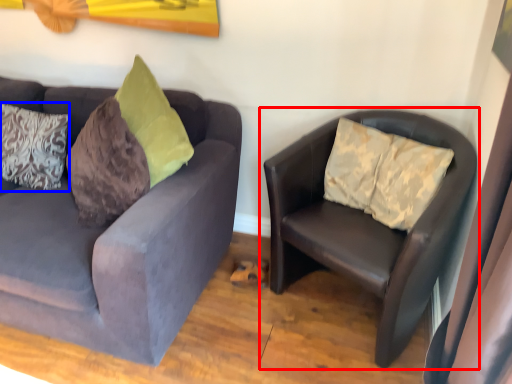
Question: Which object appears closest to the camera in this image, studio couch (highlighted by a red box) or pillow (highlighted by a blue box)?

Choices:
 (A) studio couch
 (B) pillow

Answer: (A)